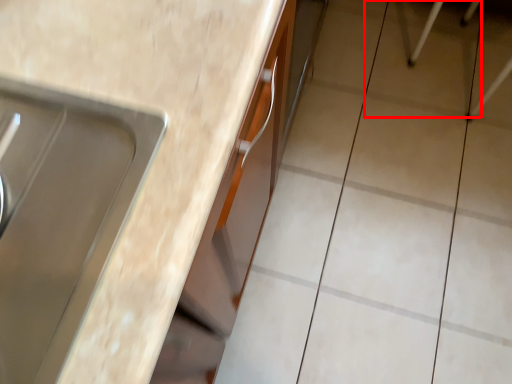
Question: Where is ceramic tile (annotated by the red box) located in relation to countertop in the image?

Choices:
 (A) left
 (B) right

Answer: (B)